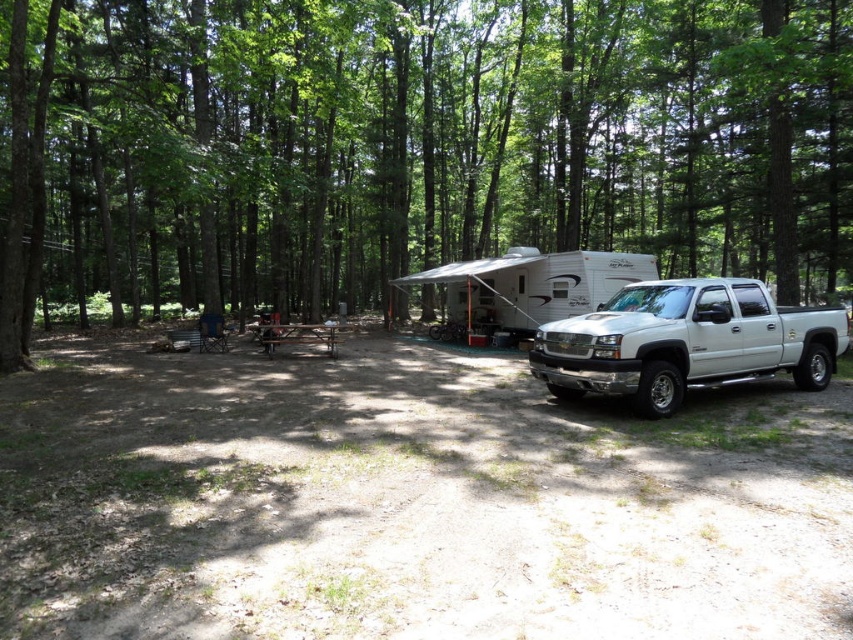
Question: Can you confirm if green leafy tree at center is positioned below white metallic pickup truck at right?

Choices:
 (A) yes
 (B) no

Answer: (B)

Question: Can you confirm if green leafy tree at center is positioned to the left of brown wooden picnic table at center?

Choices:
 (A) no
 (B) yes

Answer: (A)

Question: Which of the following is the closest to the observer?

Choices:
 (A) white metallic pickup truck at right
 (B) brown wooden picnic table at center
 (C) green leafy tree at center

Answer: (A)

Question: Estimate the real-world distances between objects in this image. Which object is closer to the white metallic pickup truck at right?

Choices:
 (A) brown wooden picnic table at center
 (B) green leafy tree at center

Answer: (A)

Question: Estimate the real-world distances between objects in this image. Which object is farther from the white metallic pickup truck at right?

Choices:
 (A) green leafy tree at center
 (B) brown wooden picnic table at center

Answer: (A)

Question: Is green leafy tree at center bigger than white metallic pickup truck at right?

Choices:
 (A) yes
 (B) no

Answer: (A)